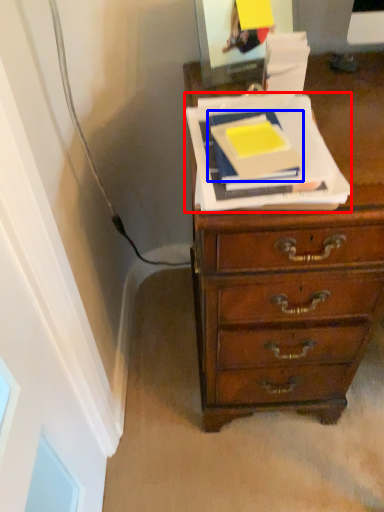
Question: Which object is further to the camera taking this photo, paperback book (highlighted by a red box) or paperback book (highlighted by a blue box)?

Choices:
 (A) paperback book
 (B) paperback book

Answer: (B)